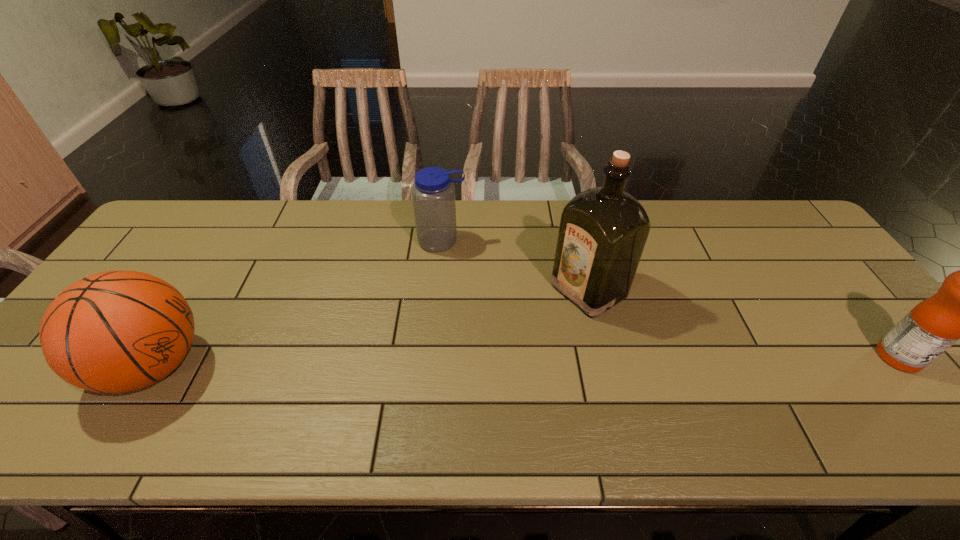
Find the location of a particular element. The height and width of the screenshot is (540, 960). vacant space that satisfies the following two spatial constraints: 1. on the front side of the second object from right to left; 2. on the front label of the fruit juice is located at coordinates (604, 357).

Where is `vacant region that satisfies the following two spatial constraints: 1. on the back side of the leftmost object; 2. on the right side of the water bottle`? Image resolution: width=960 pixels, height=540 pixels. vacant region that satisfies the following two spatial constraints: 1. on the back side of the leftmost object; 2. on the right side of the water bottle is located at coordinates (230, 241).

Where is `vacant space that satisfies the following two spatial constraints: 1. on the back side of the basketball; 2. on the front label of the rightmost object`? vacant space that satisfies the following two spatial constraints: 1. on the back side of the basketball; 2. on the front label of the rightmost object is located at coordinates (159, 357).

I want to click on vacant space that satisfies the following two spatial constraints: 1. on the front side of the fruit juice; 2. on the front label of the third object from right to left, so 431,357.